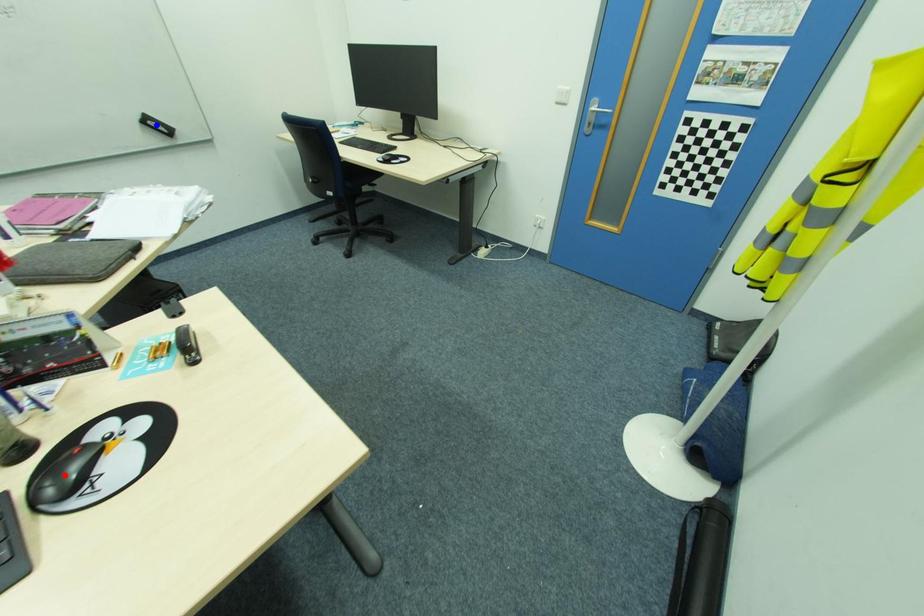
Question: Which of the two points in the image is closer to the camera?

Choices:
 (A) Blue point is closer.
 (B) Red point is closer.

Answer: (B)